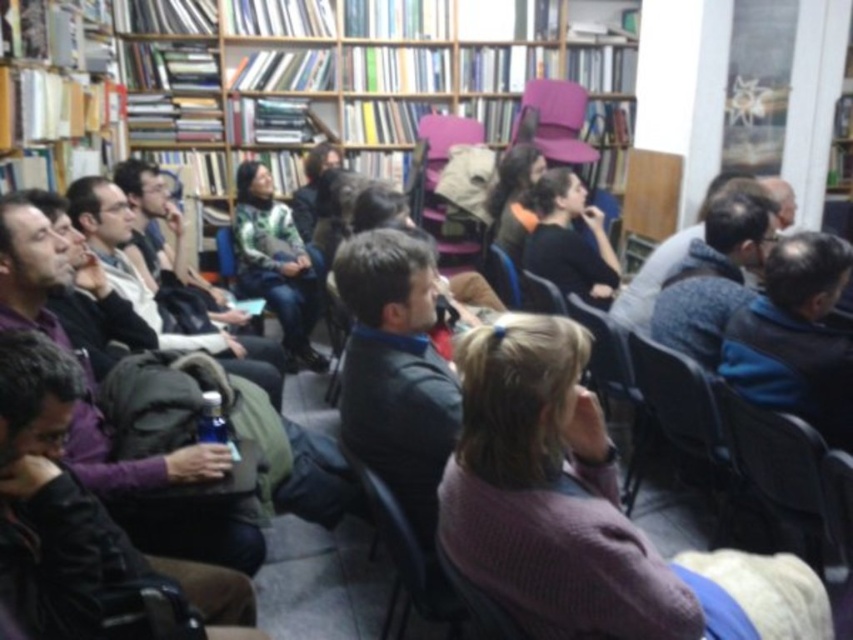
Looking at this image, can you confirm if purple fabric chair at center is smaller than pink fabric chair at upper center?

No, purple fabric chair at center is not smaller than pink fabric chair at upper center.

This screenshot has width=853, height=640. Describe the element at coordinates (444, 195) in the screenshot. I see `purple fabric chair at center` at that location.

Who is more forward, (440,170) or (538,131)?

Point (538,131)

Locate an element on the screen. purple fabric chair at center is located at coordinates (444, 195).

Is purple fabric chair at center to the right of wooden chair at center from the viewer's perspective?

Indeed, purple fabric chair at center is positioned on the right side of wooden chair at center.

How far apart are purple fabric chair at center and wooden chair at center?

4.25 feet

Does point (428, 122) come closer to viewer compared to point (233, 266)?

No, it is not.

The image size is (853, 640). Identify the location of purple fabric chair at center. (444, 195).

Can you confirm if green textured sweater at center is bigger than pink fabric chair at upper center?

Correct, green textured sweater at center is larger in size than pink fabric chair at upper center.

Who is positioned more to the right, green textured sweater at center or pink fabric chair at upper center?

Positioned to the right is pink fabric chair at upper center.

Is point (318, 362) more distant than point (540, 144)?

No, (318, 362) is closer to viewer.

Identify the location of green textured sweater at center. This screenshot has width=853, height=640. (276, 262).